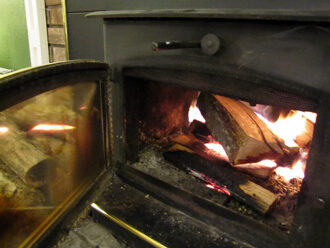
Where is `detailed trim`? detailed trim is located at coordinates (121, 223), (69, 34).